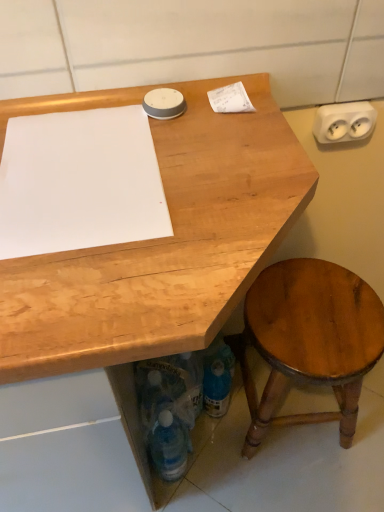
This screenshot has height=512, width=384. In order to click on free space in front of white paper at upper left, acting as the second notepad starting from the top in this screenshot , I will do `click(111, 294)`.